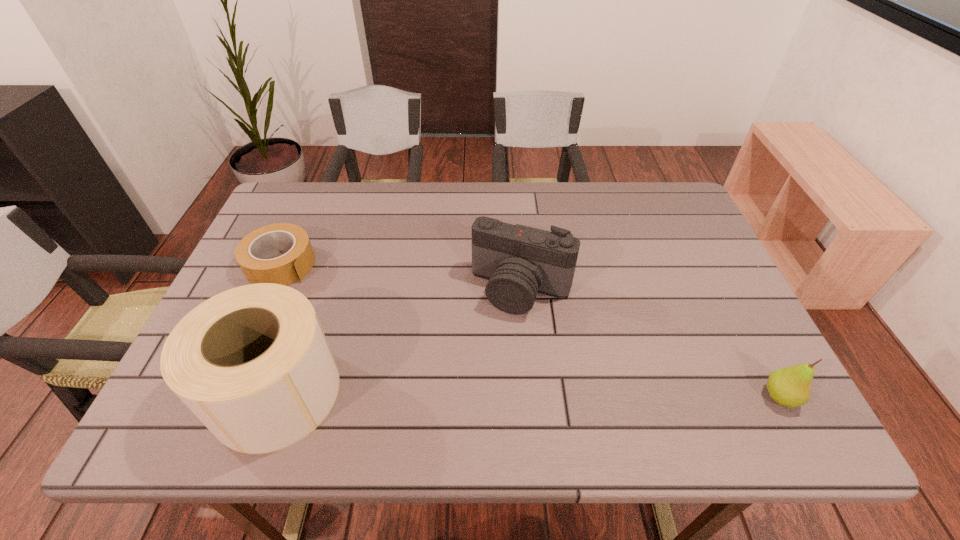
The height and width of the screenshot is (540, 960). In the image, there is a desktop. What are the coordinates of `blank space at the near edge` in the screenshot? It's located at (527, 390).

In order to click on free region at the right edge in this screenshot , I will do `click(685, 239)`.

Where is `vacant area at the far left corner of the desktop`? This screenshot has height=540, width=960. vacant area at the far left corner of the desktop is located at coordinates (327, 188).

The width and height of the screenshot is (960, 540). Identify the location of free spot between the pear and the duct tape. (530, 330).

You are a GUI agent. You are given a task and a screenshot of the screen. Output one action in this format:
    pyautogui.click(x=<x>, y=<y>)
    Task: Click on the vacant space that is in between the camera and the toilet tissue
    This screenshot has height=540, width=960.
    Given the screenshot: What is the action you would take?
    pyautogui.click(x=399, y=341)

Image resolution: width=960 pixels, height=540 pixels. I want to click on unoccupied area between the third object from left to right and the shortest object, so click(x=401, y=276).

This screenshot has width=960, height=540. Identify the location of free area in between the toilet tissue and the rightmost object. (528, 395).

Identify the location of vacant space that's between the toilet tissue and the third tallest object. (528, 395).

Identify the location of free spot between the second shortest object and the duct tape. This screenshot has height=540, width=960. (530, 330).

Identify the location of vacant space that is in between the shortest object and the rightmost object. The height and width of the screenshot is (540, 960). (530, 330).